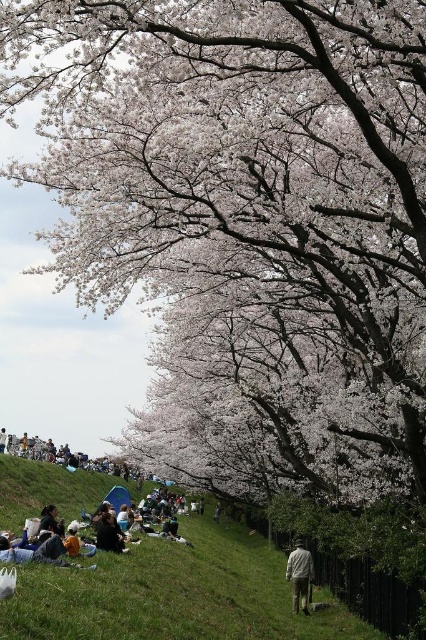
Can you confirm if green grassy hillside at lower center is bigger than light brown fabric jacket at lower center?

Indeed, green grassy hillside at lower center has a larger size compared to light brown fabric jacket at lower center.

Is green grassy hillside at lower center thinner than light brown fabric jacket at lower center?

No, green grassy hillside at lower center is not thinner than light brown fabric jacket at lower center.

You are a GUI agent. You are given a task and a screenshot of the screen. Output one action in this format:
    pyautogui.click(x=<x>, y=<y>)
    Task: Click on the green grassy hillside at lower center
    
    Given the screenshot: What is the action you would take?
    pyautogui.click(x=173, y=593)

Between light brown fabric jacket at lower center and dark brown hair at lower center, which one is positioned higher?

dark brown hair at lower center is higher up.

Is light brown fabric jacket at lower center bigger than dark brown hair at lower center?

Correct, light brown fabric jacket at lower center is larger in size than dark brown hair at lower center.

Between point (296, 560) and point (109, 516), which one is positioned in front?

Point (296, 560)

Find the location of a particular element. The height and width of the screenshot is (640, 426). light brown fabric jacket at lower center is located at coordinates (299, 576).

Looking at this image, who is positioned more to the left, green grassy hillside at lower center or dark brown hair at lower center?

dark brown hair at lower center is more to the left.

Can you confirm if green grassy hillside at lower center is wider than dark brown hair at lower center?

Yes, green grassy hillside at lower center is wider than dark brown hair at lower center.

Identify the location of green grassy hillside at lower center. (173, 593).